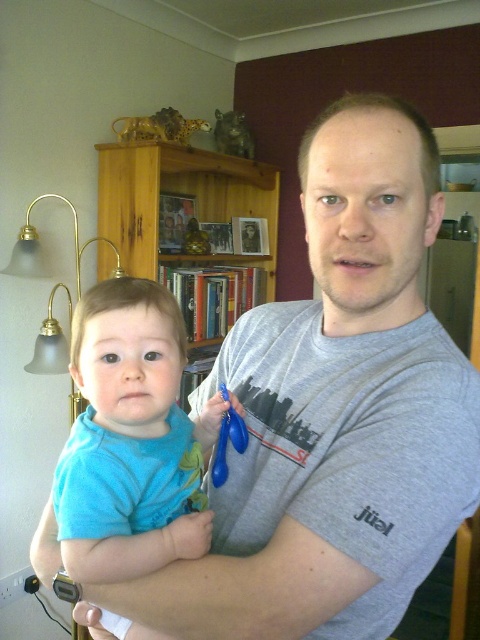
Question: Is gray cotton t-shirt at center to the left of wooden bookshelf at upper center from the viewer's perspective?

Choices:
 (A) no
 (B) yes

Answer: (A)

Question: Which point appears closest to the camera in this image?

Choices:
 (A) (272, 264)
 (B) (326, 148)

Answer: (B)

Question: Does gray cotton t-shirt at center appear on the left side of wooden bookshelf at upper center?

Choices:
 (A) no
 (B) yes

Answer: (A)

Question: Does gray cotton t-shirt at center appear under wooden bookshelf at upper center?

Choices:
 (A) no
 (B) yes

Answer: (B)

Question: Which object appears farthest from the camera in this image?

Choices:
 (A) wooden bookshelf at upper center
 (B) gray cotton t-shirt at center

Answer: (A)